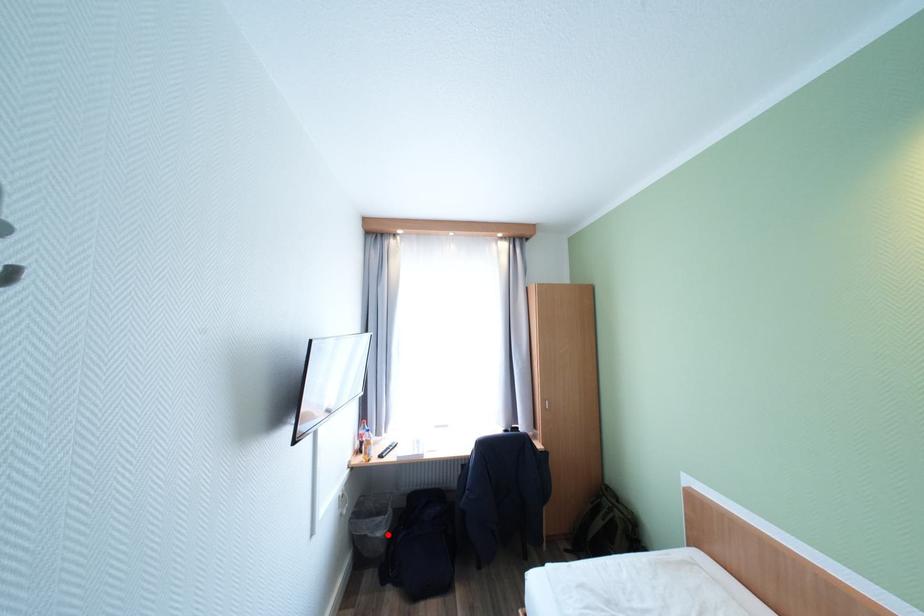
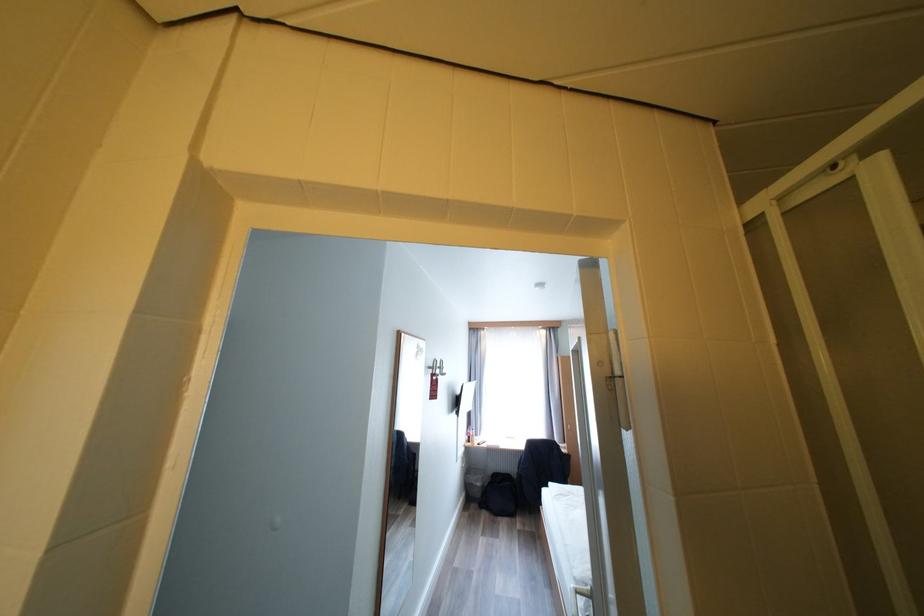
Find the pixel in the second image that matches the highlighted location in the first image.

(485, 485)